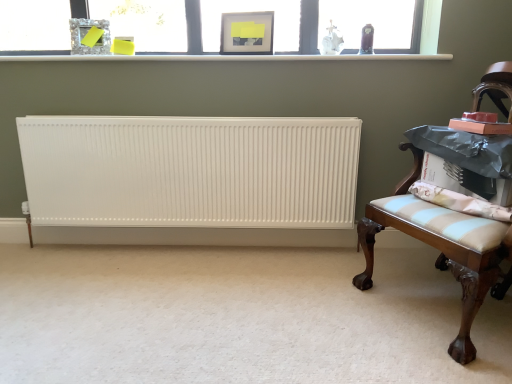
Question: From a real-world perspective, is white plastic window sill at upper center positioned under light blue striped cushion at right based on gravity?

Choices:
 (A) yes
 (B) no

Answer: (B)

Question: Is white plastic window sill at upper center to the right of light blue striped cushion at right from the viewer's perspective?

Choices:
 (A) no
 (B) yes

Answer: (A)

Question: Can we say white plastic window sill at upper center lies outside light blue striped cushion at right?

Choices:
 (A) yes
 (B) no

Answer: (A)

Question: Is white plastic window sill at upper center in front of light blue striped cushion at right?

Choices:
 (A) yes
 (B) no

Answer: (B)

Question: Is light blue striped cushion at right a part of white plastic window sill at upper center?

Choices:
 (A) no
 (B) yes

Answer: (A)

Question: Looking at the image, does clear glass window at upper center seem bigger or smaller compared to matte glass picture frame at upper center, placed as the second picture frame when sorted from left to right?

Choices:
 (A) big
 (B) small

Answer: (A)

Question: Looking at their shapes, would you say clear glass window at upper center is wider or thinner than matte glass picture frame at upper center, placed as the second picture frame when sorted from left to right?

Choices:
 (A) wide
 (B) thin

Answer: (B)

Question: Does point (435, 1) appear closer or farther from the camera than point (252, 21)?

Choices:
 (A) closer
 (B) farther

Answer: (A)

Question: Considering the positions of clear glass window at upper center and matte glass picture frame at upper center, placed as the second picture frame when sorted from left to right, in the image, is clear glass window at upper center taller or shorter than matte glass picture frame at upper center, placed as the second picture frame when sorted from left to right,?

Choices:
 (A) tall
 (B) short

Answer: (A)

Question: From the image's perspective, is white matte radiator at lower left positioned above or below white ribbed radiator at center?

Choices:
 (A) below
 (B) above

Answer: (A)

Question: Is white matte radiator at lower left inside or outside of white ribbed radiator at center?

Choices:
 (A) outside
 (B) inside

Answer: (A)

Question: Does point (444, 332) appear closer or farther from the camera than point (126, 236)?

Choices:
 (A) farther
 (B) closer

Answer: (B)

Question: In the image, is white matte radiator at lower left positioned in front of or behind white ribbed radiator at center?

Choices:
 (A) front
 (B) behind

Answer: (A)

Question: Is point (455, 355) closer or farther from the camera than point (253, 39)?

Choices:
 (A) farther
 (B) closer

Answer: (B)

Question: In terms of width, does mahogany wood bench at right look wider or thinner when compared to matte glass picture frame at upper center, placed as the second picture frame when sorted from left to right?

Choices:
 (A) thin
 (B) wide

Answer: (B)